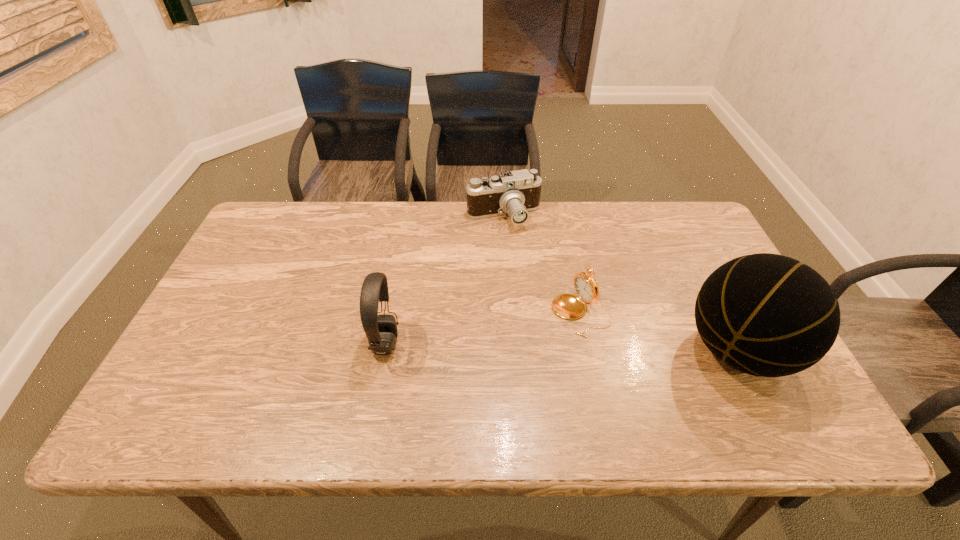
Locate an element on the screen. The width and height of the screenshot is (960, 540). vacant position at the near edge of the desktop is located at coordinates (701, 382).

What are the coordinates of `free space at the left edge of the desktop` in the screenshot? It's located at (x=230, y=308).

At what (x,y) coordinates should I click in order to perform the action: click on vacant space at the near left corner of the desktop. Please return your answer as a coordinate pair (x, y). The height and width of the screenshot is (540, 960). Looking at the image, I should click on (221, 374).

Where is `vacant area at the far right corner of the desktop`? vacant area at the far right corner of the desktop is located at coordinates (660, 239).

Locate an element on the screen. The image size is (960, 540). free spot between the basketball and the pocket watch is located at coordinates (660, 332).

Find the location of a particular element. The height and width of the screenshot is (540, 960). vacant area that lies between the leftmost object and the camera is located at coordinates (444, 280).

Identify the location of empty location between the pocket watch and the basketball. (660, 332).

Find the location of a particular element. blank region between the farthest object and the pocket watch is located at coordinates (542, 265).

Where is `empty location between the rightmost object and the leftmost object`? empty location between the rightmost object and the leftmost object is located at coordinates (562, 347).

Identify the location of free space between the second tallest object and the pocket watch. The height and width of the screenshot is (540, 960). (483, 328).